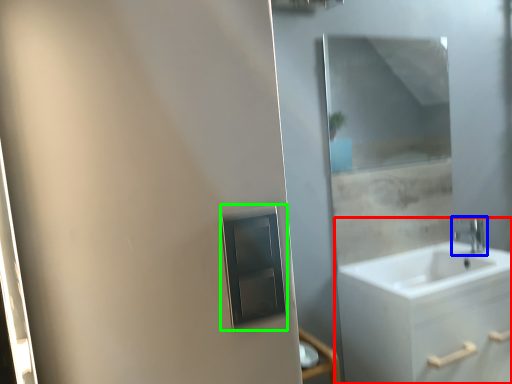
Question: Which is farther away from bathroom cabinet (highlighted by a red box)? tap (highlighted by a blue box) or medicine cabinet (highlighted by a green box)?

Choices:
 (A) tap
 (B) medicine cabinet

Answer: (B)